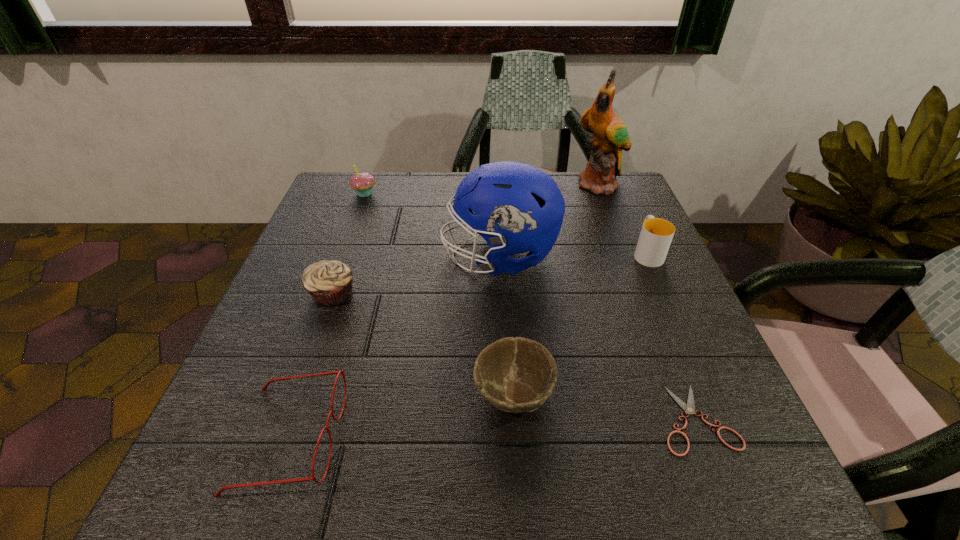
Find the location of a particular element. The height and width of the screenshot is (540, 960). blank space that satisfies the following two spatial constraints: 1. on the front-facing side of the second tallest object; 2. on the left side of the bowl is located at coordinates (507, 395).

Find the location of a particular element. free spot that satisfies the following two spatial constraints: 1. on the front side of the shortest object; 2. on the face of the spectacles is located at coordinates (704, 438).

Find the location of a particular element. free spot that satisfies the following two spatial constraints: 1. on the back side of the shortest object; 2. on the front-facing side of the football helmet is located at coordinates (631, 256).

Find the location of `free spot that satisfies the following two spatial constraints: 1. on the front-facing side of the shortest object; 2. on the right side of the tallest object`. free spot that satisfies the following two spatial constraints: 1. on the front-facing side of the shortest object; 2. on the right side of the tallest object is located at coordinates (690, 419).

Image resolution: width=960 pixels, height=540 pixels. In order to click on free location that satisfies the following two spatial constraints: 1. on the front side of the bowl; 2. on the right side of the muffin in this screenshot , I will do `click(297, 395)`.